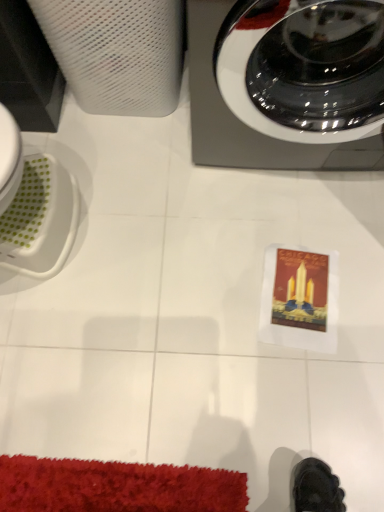
Question: From a real-world perspective, is white mesh paper towel at upper left physically located above or below metallic gray washing machine at upper right?

Choices:
 (A) above
 (B) below

Answer: (B)

Question: Would you say white mesh paper towel at upper left is to the left or to the right of metallic gray washing machine at upper right in the picture?

Choices:
 (A) left
 (B) right

Answer: (A)

Question: From the image's perspective, is white mesh paper towel at upper left located above or below metallic gray washing machine at upper right?

Choices:
 (A) below
 (B) above

Answer: (B)

Question: From the image's perspective, is metallic gray washing machine at upper right above or below white mesh paper towel at upper left?

Choices:
 (A) below
 (B) above

Answer: (A)

Question: Considering the relative positions of metallic gray washing machine at upper right and white mesh paper towel at upper left in the image provided, is metallic gray washing machine at upper right to the left or to the right of white mesh paper towel at upper left?

Choices:
 (A) left
 (B) right

Answer: (B)

Question: Considering the positions of metallic gray washing machine at upper right and white mesh paper towel at upper left in the image, is metallic gray washing machine at upper right taller or shorter than white mesh paper towel at upper left?

Choices:
 (A) tall
 (B) short

Answer: (A)

Question: Is metallic gray washing machine at upper right bigger or smaller than white mesh paper towel at upper left?

Choices:
 (A) small
 (B) big

Answer: (B)